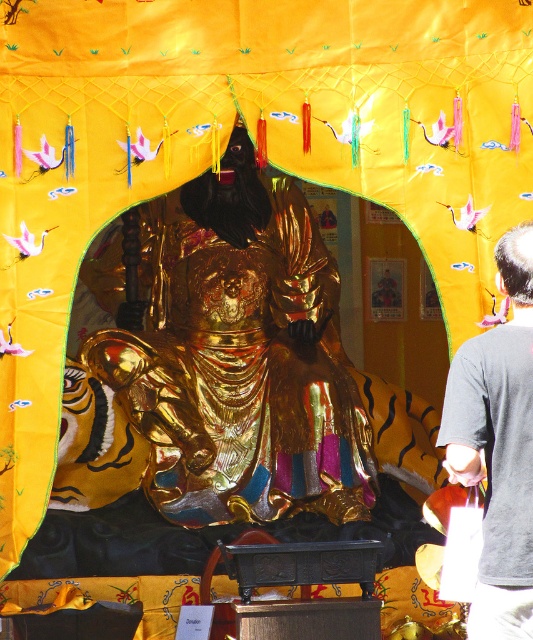
You are a photographer standing at a certain distance from the gold shiny statue at center. You want to capture a closeup shot of the statue. Given that your camera has a maximum zoom range of 200 feet, will you be able to take the closeup without moving closer?

The distance between you and the gold shiny statue at center is 320.22 feet, which exceeds the camera maximum zoom range of 200 feet. Therefore, you cannot take a closeup without moving closer.

You are a photographer trying to capture the gold shiny statue at center and the dark gray shirt at right in the same frame. Which object should you focus on first to ensure both are in the frame without moving the camera?

The gold shiny statue at center is bigger than the dark gray shirt at right, so you should focus on the gold shiny statue at center first to ensure it fits within the frame before adjusting for the smaller dark gray shirt at right.

Based on the photo, you are an artist trying to sketch the scene. You notice the gold shiny statue at center and the dark gray shirt at right. Which object is closer to you?

The gold shiny statue at center is closer to you because the dark gray shirt at right is behind it.